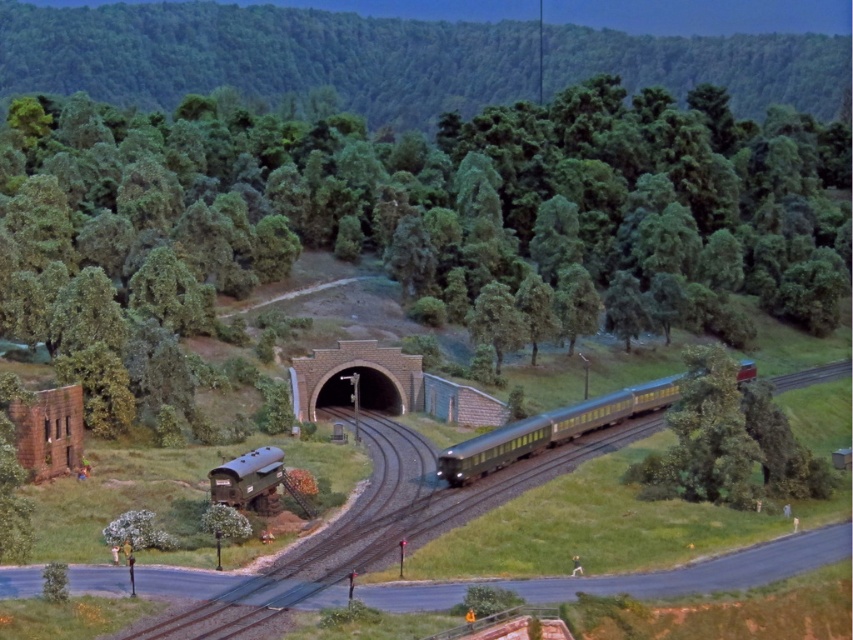
Question: Which of the following is the closest to the observer?

Choices:
 (A) metallic blue tank car at lower left
 (B) green matte tree at center

Answer: (A)

Question: Can you confirm if green matte tree at center is smaller than metallic blue tank car at lower left?

Choices:
 (A) no
 (B) yes

Answer: (A)

Question: Can you confirm if metallic green train at center is positioned to the right of metallic blue tank car at lower left?

Choices:
 (A) no
 (B) yes

Answer: (B)

Question: Which point is farther to the camera?

Choices:
 (A) (230, 500)
 (B) (675, 394)
 (C) (129, 173)

Answer: (C)

Question: Is metallic green train at center smaller than metallic blue tank car at lower left?

Choices:
 (A) no
 (B) yes

Answer: (A)

Question: Which is nearer to the green matte tree at center?

Choices:
 (A) metallic blue tank car at lower left
 (B) metallic green train at center

Answer: (B)